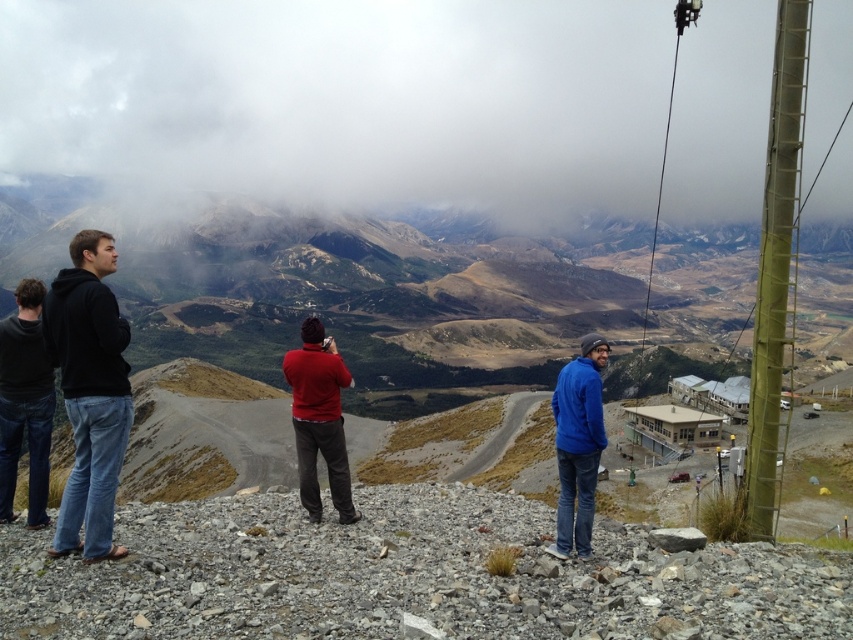
Who is more distant from viewer, (444, 394) or (15, 449)?

Positioned behind is point (444, 394).

Does brown grassy mountain at center lie in front of dark gray sweater at left?

No, brown grassy mountain at center is further to the viewer.

Does point (811, 332) come farther from viewer compared to point (0, 476)?

That is True.

Locate an element on the screen. brown grassy mountain at center is located at coordinates (396, 291).

Who is shorter, smooth gray rock at center or dark gray sweater at left?

smooth gray rock at center is shorter.

Based on the photo, can you confirm if smooth gray rock at center is positioned below dark gray sweater at left?

Indeed, smooth gray rock at center is positioned under dark gray sweater at left.

Does point (57, 576) lie in front of point (22, 323)?

Yes, point (57, 576) is in front of point (22, 323).

The width and height of the screenshot is (853, 640). Find the location of `smooth gray rock at center`. smooth gray rock at center is located at coordinates (407, 577).

Can you confirm if smooth gray rock at center is smaller than black cotton hoodie at left?

Yes, smooth gray rock at center is smaller than black cotton hoodie at left.

Is smooth gray rock at center positioned at the back of black cotton hoodie at left?

That is False.

Which is behind, point (196, 589) or point (90, 392)?

Positioned behind is point (90, 392).

This screenshot has width=853, height=640. I want to click on smooth gray rock at center, so click(x=407, y=577).